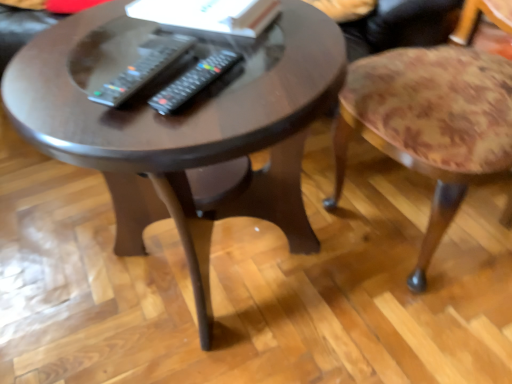
Locate an element on the screen. This screenshot has width=512, height=384. vacant space to the left of black plastic remote at center, acting as the 1th remote starting from the right is located at coordinates (70, 103).